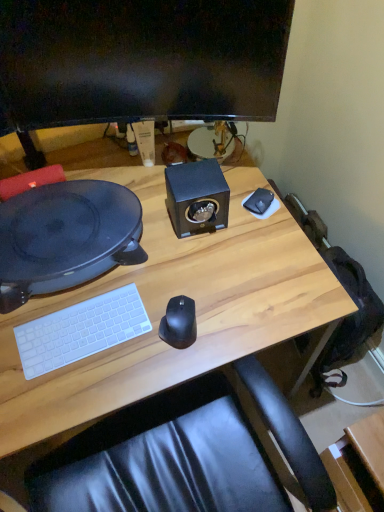
This screenshot has height=512, width=384. Identify the location of blank space situated above white matte keyboard at lower left (from a real-world perspective). (80, 326).